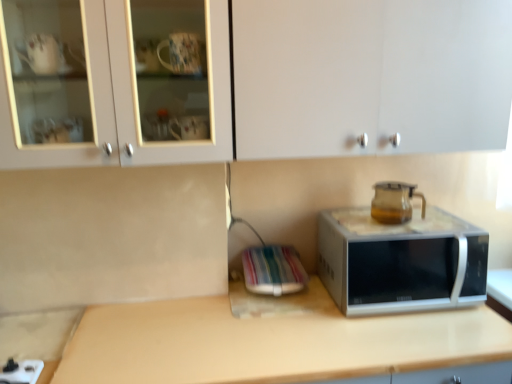
Question: Can you confirm if silver metallic microwave at center is smaller than transparent glass coffeepot at upper right?

Choices:
 (A) yes
 (B) no

Answer: (B)

Question: Is silver metallic microwave at center closer to camera compared to transparent glass coffeepot at upper right?

Choices:
 (A) yes
 (B) no

Answer: (A)

Question: From the image's perspective, is silver metallic microwave at center above transparent glass coffeepot at upper right?

Choices:
 (A) no
 (B) yes

Answer: (A)

Question: Could you tell me if silver metallic microwave at center is facing transparent glass coffeepot at upper right?

Choices:
 (A) no
 (B) yes

Answer: (A)

Question: Is silver metallic microwave at center turned away from transparent glass coffeepot at upper right?

Choices:
 (A) yes
 (B) no

Answer: (B)

Question: From a real-world perspective, is silver metallic microwave at center located higher than transparent glass coffeepot at upper right?

Choices:
 (A) no
 (B) yes

Answer: (A)

Question: Can silver metallic microwave at center be found inside white glossy cabinet at upper center?

Choices:
 (A) no
 (B) yes

Answer: (A)

Question: Does white glossy cabinet at upper center come in front of silver metallic microwave at center?

Choices:
 (A) no
 (B) yes

Answer: (B)

Question: Considering the relative positions of white glossy cabinet at upper center and silver metallic microwave at center in the image provided, is white glossy cabinet at upper center to the right of silver metallic microwave at center from the viewer's perspective?

Choices:
 (A) yes
 (B) no

Answer: (B)

Question: Is white glossy cabinet at upper center shorter than silver metallic microwave at center?

Choices:
 (A) no
 (B) yes

Answer: (A)

Question: Considering the relative sizes of white glossy cabinet at upper center and silver metallic microwave at center in the image provided, is white glossy cabinet at upper center bigger than silver metallic microwave at center?

Choices:
 (A) no
 (B) yes

Answer: (B)

Question: Does white glossy cabinet at upper center have a greater width compared to silver metallic microwave at center?

Choices:
 (A) no
 (B) yes

Answer: (A)

Question: Is beige laminate countertop at center with silver metallic microwave at center?

Choices:
 (A) yes
 (B) no

Answer: (B)